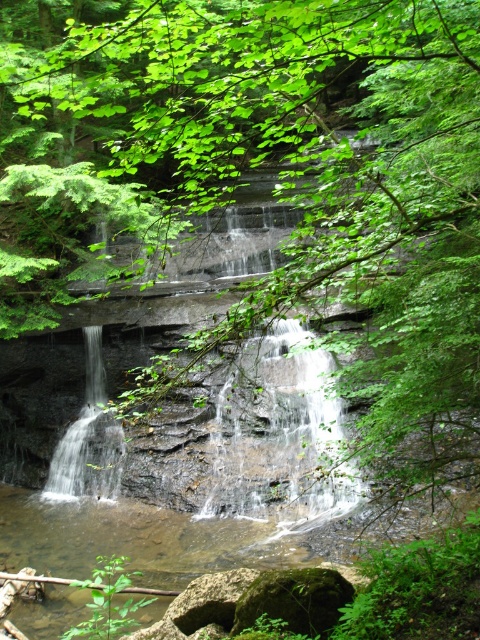
You are a hiker carrying a 1.5 meter long backpack. You want to place your backpack between the smooth gray rock at center and the translucent white water at left. Is there enough space for your backpack to fit between them?

The smooth gray rock at center is 2.06 meters away from the translucent white water at left. Since your backpack is 1.5 meters long, there is enough space between them to place it.

You are standing at the origin point of the coordinate system in the image. You want to locate the smooth gray rock at center. What are its coordinates?

The smooth gray rock at center is located at coordinates point (277, 432).